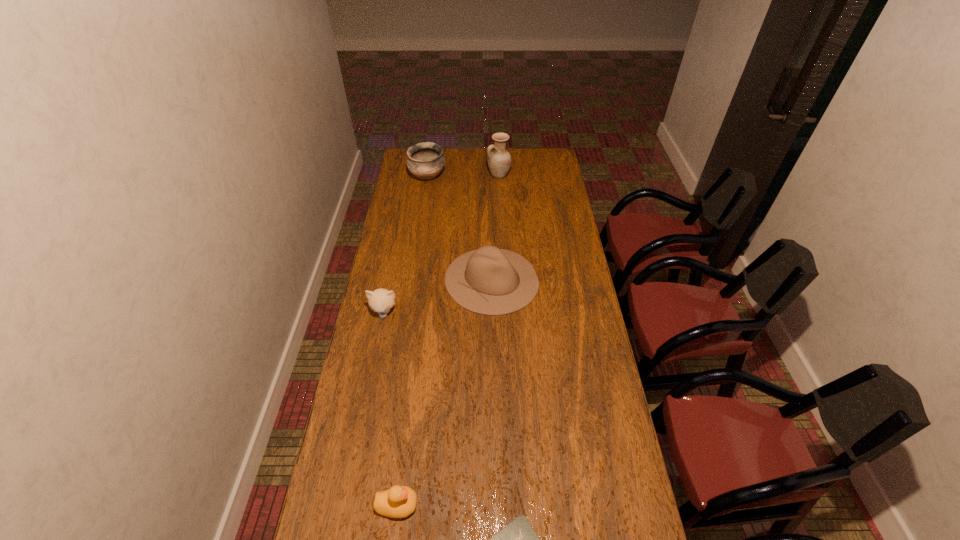
I want to click on vacant area situated on the face of the fifth tallest object, so click(x=549, y=505).

The image size is (960, 540). Identify the location of pottery that is at the left edge. (425, 160).

Where is `kitten at the left edge`? This screenshot has width=960, height=540. kitten at the left edge is located at coordinates (381, 300).

Find the location of `duck located at the left edge`. duck located at the left edge is located at coordinates (399, 501).

The height and width of the screenshot is (540, 960). Find the location of `object situated at the far left corner`. object situated at the far left corner is located at coordinates (425, 160).

In the image, there is a desktop. Where is `vacant space at the left edge`? vacant space at the left edge is located at coordinates (396, 291).

In the image, there is a desktop. Find the location of `vacant region at the right edge`. vacant region at the right edge is located at coordinates (593, 320).

Image resolution: width=960 pixels, height=540 pixels. Find the location of `blank space at the far left corner of the desktop`. blank space at the far left corner of the desktop is located at coordinates (404, 168).

The height and width of the screenshot is (540, 960). Find the location of `free space between the shorter pottery and the second shortest object`. free space between the shorter pottery and the second shortest object is located at coordinates (413, 341).

What are the coordinates of `vacant space that is in between the kitten and the right pottery` in the screenshot? It's located at [442, 244].